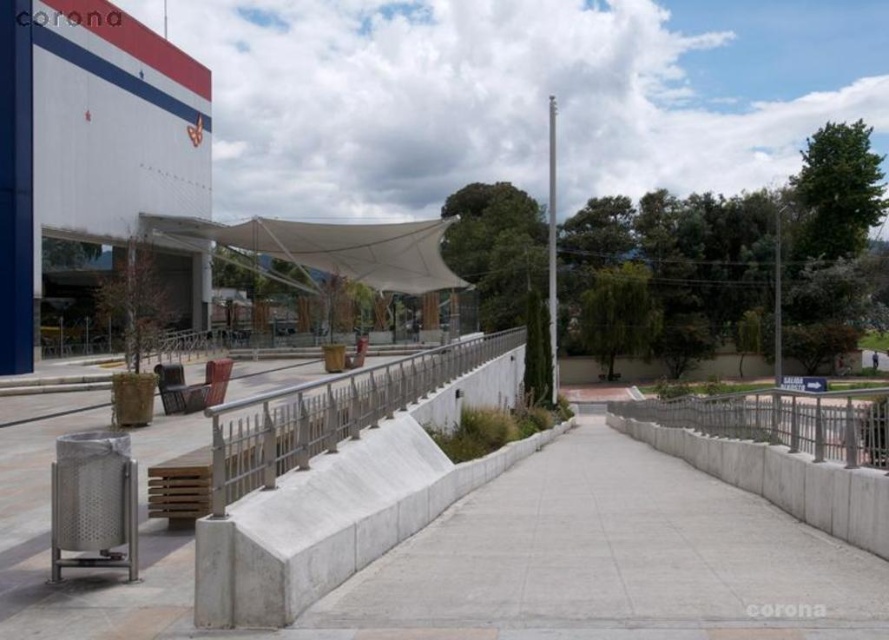
Consider the image. You are a maintenance worker needing to inspect the silver metallic rail at center and the white fabric canopy at center. Based on the scene description, which object is positioned to the right side from your viewpoint?

The silver metallic rail at center is positioned to the right of the white fabric canopy at center.

You are a maintenance worker who needs to secure a safety rope between the concrete at center and the silver metallic rail at center. Based on the scene, can you attach the rope to both objects without it dragging on the ground?

The concrete at center is below the silver metallic rail at center, so the rope can be attached to both objects without dragging on the ground because the rail is elevated above the concrete.